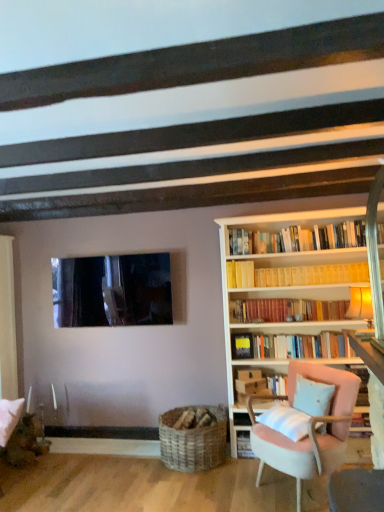
Where is `vacant area that is in front of woven wood basket at lower center`? The image size is (384, 512). vacant area that is in front of woven wood basket at lower center is located at coordinates (185, 490).